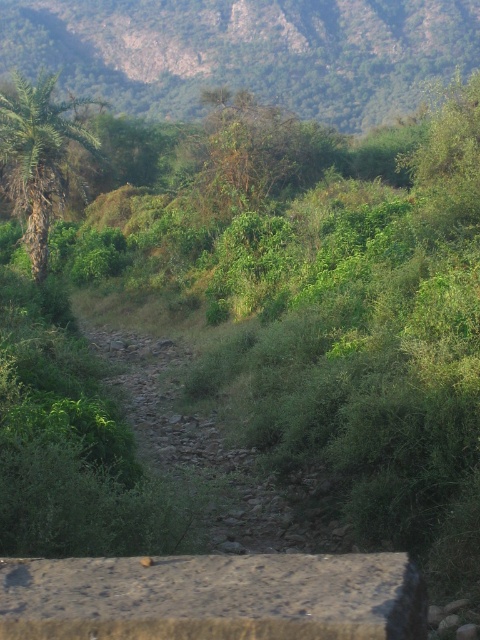
You are navigating a narrow rocky path through a lush landscape. You notice two points marked on your map at coordinates point (x=377, y=81) and point (x=13, y=106). Which point is closer to your current position if you are standing at the start of the path?

Point (x=13, y=106) is closer to your current position because it is in front of point (x=377, y=81) along the path.

You are standing at the point where the path starts in the image. Looking towards the direction the path curves, which object is located at the point marked by coordinates (245, 51)?

The green leafy hillside at upper center is located at the point marked by coordinates (245, 51).

Based on the scene description, where is the green leafy hillside at upper center located in terms of its 2D coordinates?

The green leafy hillside at upper center is located at the 2D coordinates point (x=245, y=51).